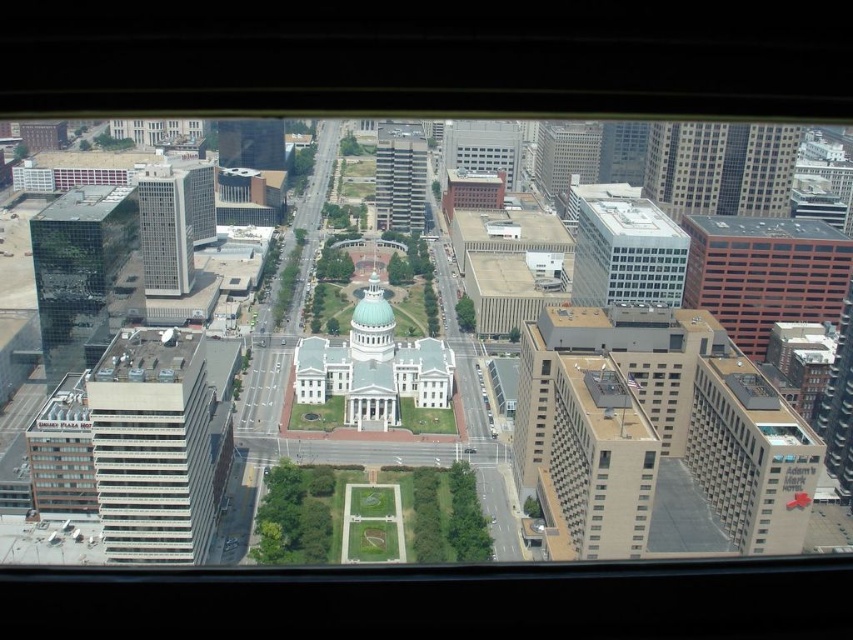
Question: Can you confirm if orange brick building at right is thinner than reflective glass skyscraper at left?

Choices:
 (A) no
 (B) yes

Answer: (A)

Question: Is glassy reflective skyscraper at left to the left of gray concrete skyscraper at center from the viewer's perspective?

Choices:
 (A) no
 (B) yes

Answer: (B)

Question: Estimate the real-world distances between objects in this image. Which object is farther from the beige brick building at right?

Choices:
 (A) reflective glass skyscraper at left
 (B) white glass building at left
 (C) glassy reflective skyscraper at left
 (D) white glass building at upper right

Answer: (A)

Question: Estimate the real-world distances between objects in this image. Which object is closer to the orange brick building at right?

Choices:
 (A) white glass building at upper right
 (B) gray concrete skyscraper at center

Answer: (A)

Question: Which of the following is the closest to the observer?

Choices:
 (A) (151, 179)
 (B) (641, 227)
 (C) (190, 394)

Answer: (C)

Question: Can you confirm if orange brick building at right is thinner than reflective glass skyscraper at left?

Choices:
 (A) yes
 (B) no

Answer: (B)